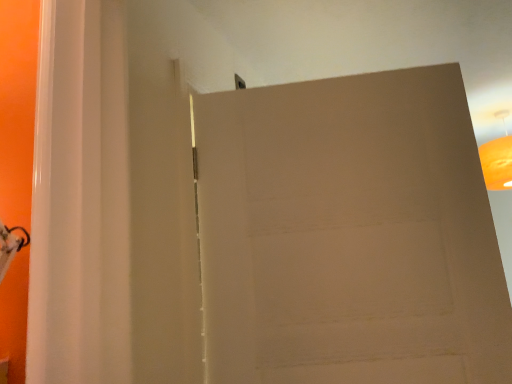
Question: Considering the relative sizes of matte brown door at upper center and orange matte lampshade at upper right in the image provided, is matte brown door at upper center wider than orange matte lampshade at upper right?

Choices:
 (A) yes
 (B) no

Answer: (B)

Question: Can you confirm if matte brown door at upper center is bigger than orange matte lampshade at upper right?

Choices:
 (A) no
 (B) yes

Answer: (B)

Question: Is matte brown door at upper center not close to orange matte lampshade at upper right?

Choices:
 (A) yes
 (B) no

Answer: (A)

Question: From the image's perspective, does matte brown door at upper center appear lower than orange matte lampshade at upper right?

Choices:
 (A) no
 (B) yes

Answer: (B)

Question: Considering the relative positions of matte brown door at upper center and orange matte lampshade at upper right in the image provided, is matte brown door at upper center behind orange matte lampshade at upper right?

Choices:
 (A) yes
 (B) no

Answer: (B)

Question: Can you confirm if matte brown door at upper center is positioned to the right of orange matte lampshade at upper right?

Choices:
 (A) yes
 (B) no

Answer: (B)

Question: From a real-world perspective, is orange matte lampshade at upper right under matte brown door at upper center?

Choices:
 (A) no
 (B) yes

Answer: (A)

Question: Does orange matte lampshade at upper right have a greater height compared to matte brown door at upper center?

Choices:
 (A) yes
 (B) no

Answer: (B)

Question: Is orange matte lampshade at upper right not inside matte brown door at upper center?

Choices:
 (A) yes
 (B) no

Answer: (A)

Question: From a real-world perspective, is orange matte lampshade at upper right positioned over matte brown door at upper center based on gravity?

Choices:
 (A) no
 (B) yes

Answer: (B)

Question: Is the position of orange matte lampshade at upper right less distant than that of matte brown door at upper center?

Choices:
 (A) no
 (B) yes

Answer: (A)

Question: From the image's perspective, is orange matte lampshade at upper right over matte brown door at upper center?

Choices:
 (A) yes
 (B) no

Answer: (A)

Question: From their relative heights in the image, would you say orange matte lampshade at upper right is taller or shorter than matte brown door at upper center?

Choices:
 (A) tall
 (B) short

Answer: (B)